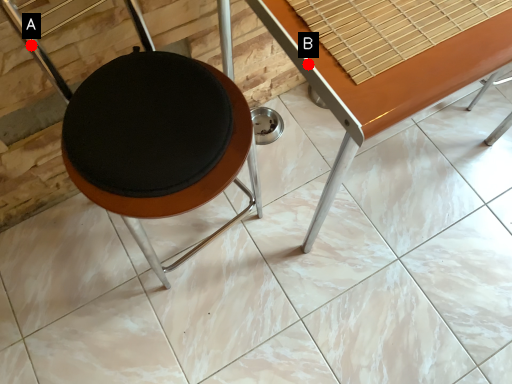
Question: Two points are circled on the image, labeled by A and B beside each circle. Which point is farther to the camera?

Choices:
 (A) A is further
 (B) B is further

Answer: (A)